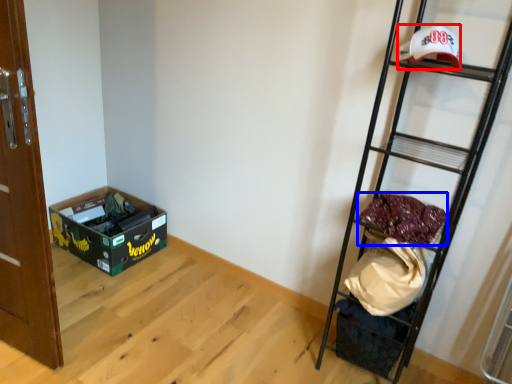
Question: Which point is further to the camera, baseball hat (highlighted by a red box) or material (highlighted by a blue box)?

Choices:
 (A) baseball hat
 (B) material

Answer: (B)